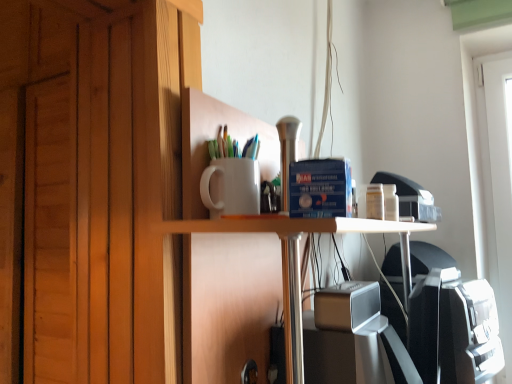
Question: Is satin silver speaker at center thinner than white matte cup at upper center?

Choices:
 (A) no
 (B) yes

Answer: (B)

Question: Does satin silver speaker at center have a greater height compared to white matte cup at upper center?

Choices:
 (A) yes
 (B) no

Answer: (B)

Question: Does satin silver speaker at center appear on the right side of white matte cup at upper center?

Choices:
 (A) yes
 (B) no

Answer: (A)

Question: Does satin silver speaker at center lie behind white matte cup at upper center?

Choices:
 (A) no
 (B) yes

Answer: (A)

Question: Can you confirm if satin silver speaker at center is wider than white matte cup at upper center?

Choices:
 (A) yes
 (B) no

Answer: (B)

Question: From the image's perspective, would you say satin silver speaker at center is shown under white matte cup at upper center?

Choices:
 (A) yes
 (B) no

Answer: (A)

Question: Considering the relative sizes of white glossy table at center and white matte cup at upper center in the image provided, is white glossy table at center taller than white matte cup at upper center?

Choices:
 (A) yes
 (B) no

Answer: (B)

Question: Does white glossy table at center have a lesser height compared to white matte cup at upper center?

Choices:
 (A) yes
 (B) no

Answer: (A)

Question: Is white glossy table at center not within white matte cup at upper center?

Choices:
 (A) yes
 (B) no

Answer: (A)

Question: Is white glossy table at center far from white matte cup at upper center?

Choices:
 (A) no
 (B) yes

Answer: (A)

Question: From the image's perspective, is white glossy table at center located above white matte cup at upper center?

Choices:
 (A) no
 (B) yes

Answer: (A)

Question: Is white matte cup at upper center at the back of white glossy table at center?

Choices:
 (A) no
 (B) yes

Answer: (B)

Question: Is white matte cup at upper center thinner than satin silver speaker at center?

Choices:
 (A) yes
 (B) no

Answer: (B)